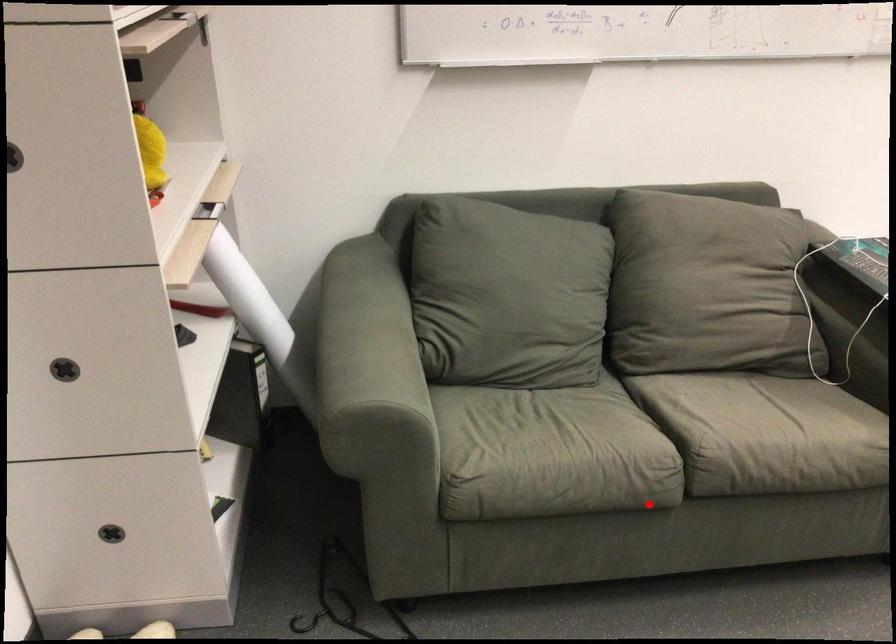
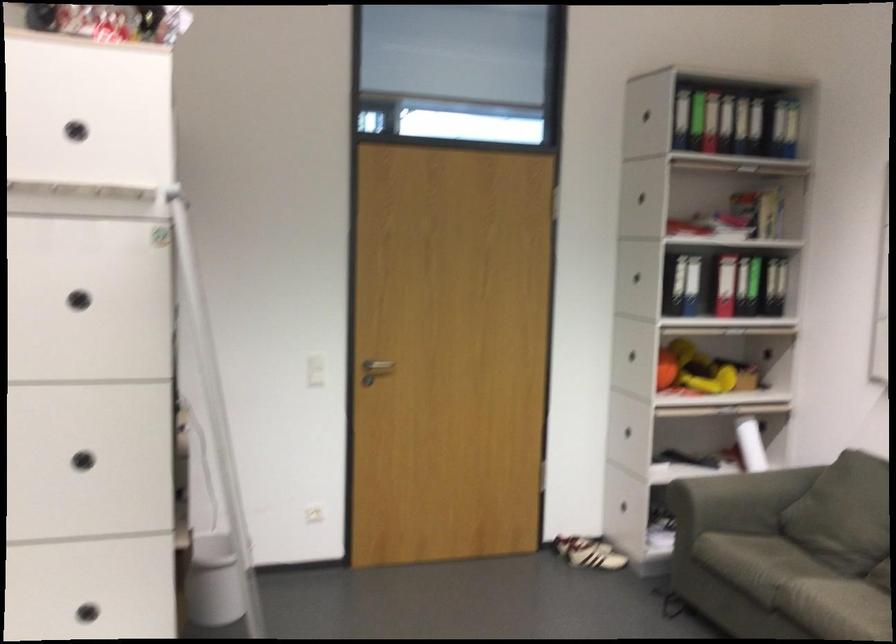
Question: I am providing you with two images of the same scene from different viewpoints. In image1, a red point is highlighted. Considering the same 3D point in image2, which of the following is correct?

Choices:
 (A) It is closer
 (B) It is farther

Answer: (B)